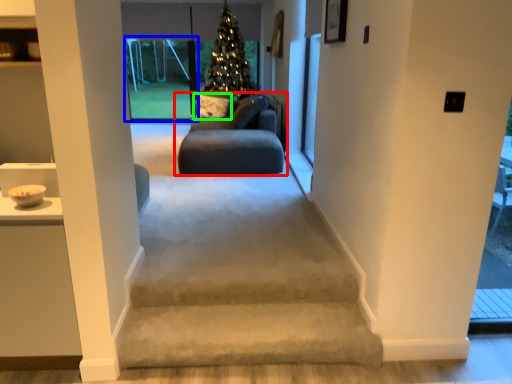
Question: Which object is the closest to the studio couch (highlighted by a red box)? Choose among these: window (highlighted by a blue box) or pillow (highlighted by a green box).

Choices:
 (A) window
 (B) pillow

Answer: (B)